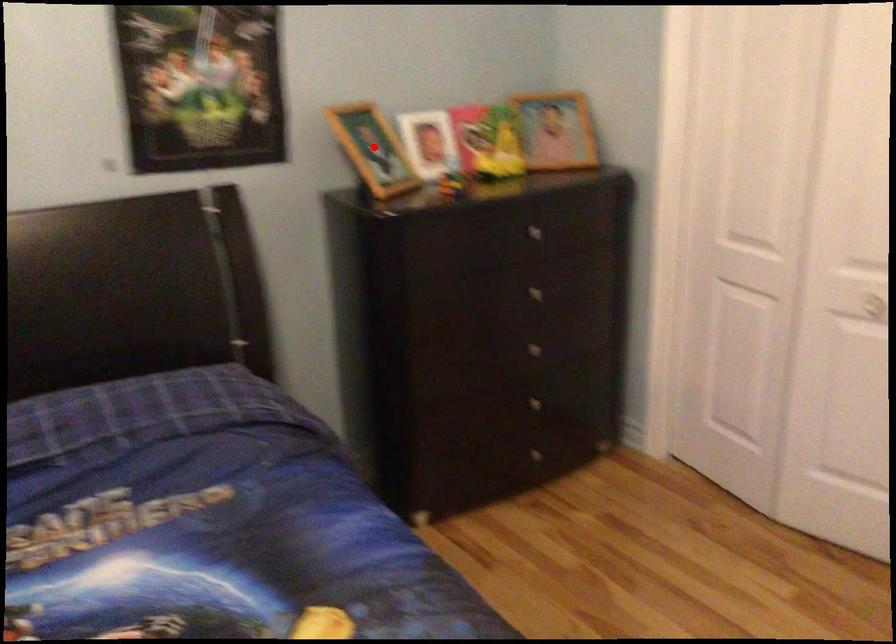
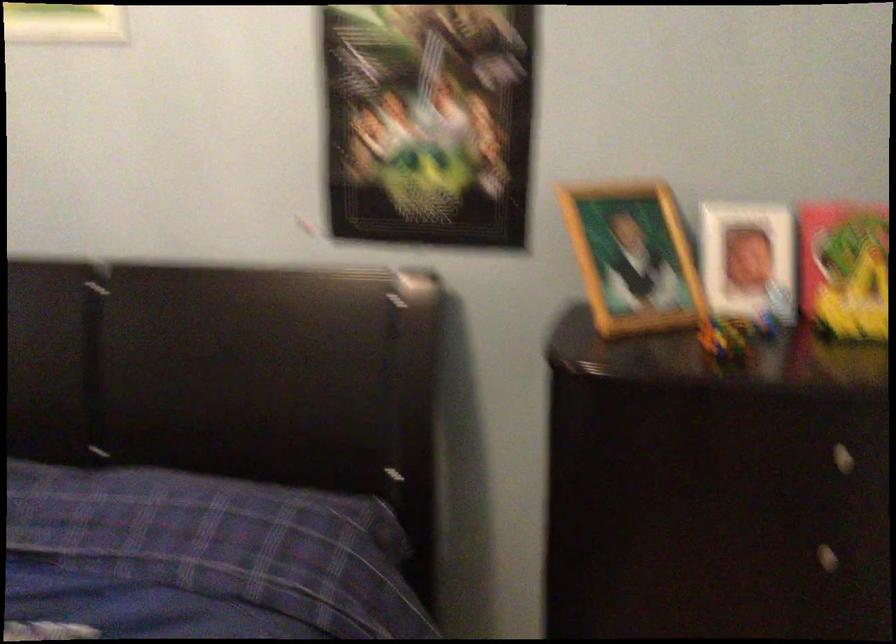
Where in the second image is the point corresponding to the highlighted location from the first image?

(633, 258)